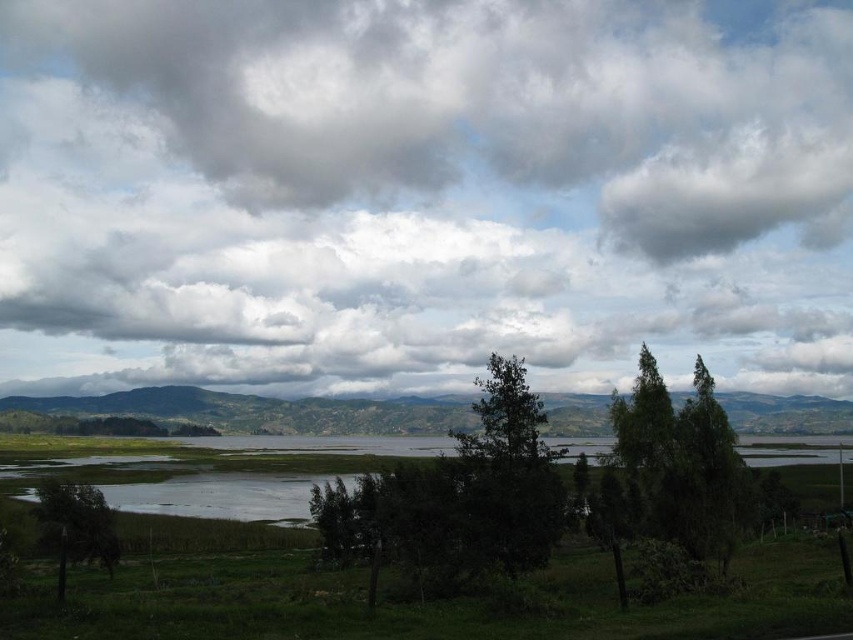
Question: Can you confirm if cloudy sky at upper center is smaller than green leafy tree at lower left?

Choices:
 (A) yes
 (B) no

Answer: (B)

Question: Among these points, which one is farthest from the camera?

Choices:
 (A) (108, 572)
 (B) (738, 138)
 (C) (502, 525)
 (D) (682, 525)

Answer: (B)

Question: Does green leafy tree at center have a greater width compared to green leafy tree at lower left?

Choices:
 (A) no
 (B) yes

Answer: (A)

Question: Which is nearer to the green leafy tree at lower left?

Choices:
 (A) cloudy sky at upper center
 (B) clear water at center

Answer: (B)

Question: Based on their relative distances, which object is nearer to the green leafy tree at right?

Choices:
 (A) clear water at center
 (B) green leafy tree at center
 (C) cloudy sky at upper center

Answer: (B)

Question: Does cloudy sky at upper center appear under green leafy tree at right?

Choices:
 (A) yes
 (B) no

Answer: (B)